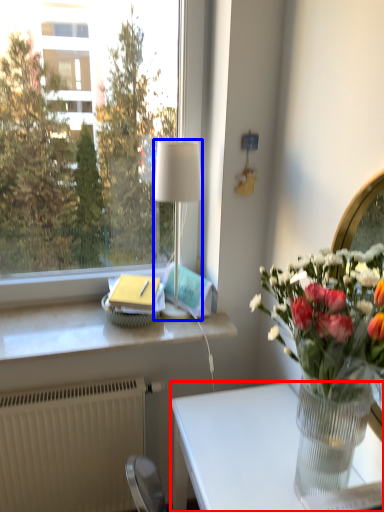
Question: Among these objects, which one is nearest to the camera, desk (highlighted by a red box) or lamp (highlighted by a blue box)?

Choices:
 (A) desk
 (B) lamp

Answer: (A)